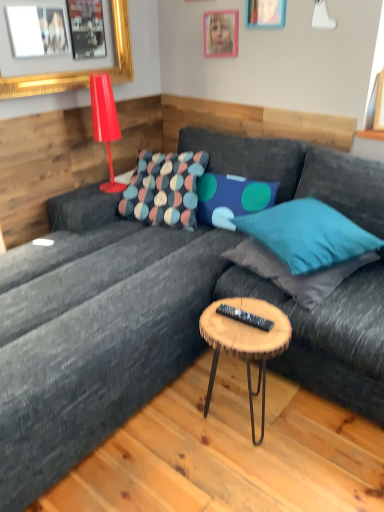
Question: In terms of width, does black plastic remote at center look wider or thinner when compared to pink plastic picture frame at upper center, marked as the second picture frame in a left-to-right arrangement?

Choices:
 (A) wide
 (B) thin

Answer: (A)

Question: Choose the correct answer: Is black plastic remote at center inside pink plastic picture frame at upper center, marked as the second picture frame in a left-to-right arrangement, or outside it?

Choices:
 (A) outside
 (B) inside

Answer: (A)

Question: Which is nearer to the shiny red lamp at upper left?

Choices:
 (A) teal fabric pillow at upper right, the 2th pillow in the right-to-left sequence
 (B) blue fabric pillow at center, which is counted as the 3th pillow, starting from the right
 (C) gold framed picture at upper left, arranged as the first picture frame when viewed from the left
 (D) black plastic remote at center
 (E) pink plastic picture frame at upper center, the 2th picture frame from the right

Answer: (C)

Question: Considering the real-world distances, which object is closest to the textured multicolored pillow at center, arranged as the 1th pillow when viewed from the left?

Choices:
 (A) woodenmaterial/texturecoffee table at center
 (B) blue fabric pillow at center, which is counted as the 3th pillow, starting from the right
 (C) teal fabric pillow at upper right, the 2th pillow in the right-to-left sequence
 (D) shiny red lamp at upper left
 (E) pink plastic picture frame at upper center, marked as the second picture frame in a left-to-right arrangement

Answer: (B)